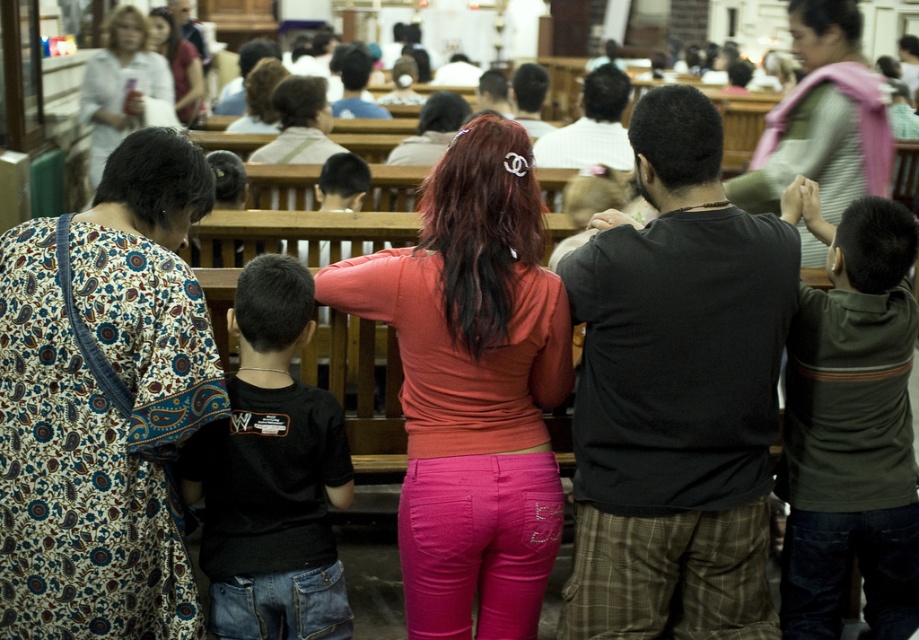
Is dark green hoodie at center closer to the viewer compared to white cotton blouse at upper left?

Yes.

What do you see at coordinates (851, 426) in the screenshot?
I see `dark green hoodie at center` at bounding box center [851, 426].

The image size is (919, 640). What are the coordinates of `dark green hoodie at center` in the screenshot? It's located at (851, 426).

Image resolution: width=919 pixels, height=640 pixels. Identify the location of dark green hoodie at center. (851, 426).

Between dark green hoodie at center and black cotton shirt at left, which one has less height?

black cotton shirt at left is shorter.

Does dark green hoodie at center have a lesser height compared to black cotton shirt at left?

In fact, dark green hoodie at center may be taller than black cotton shirt at left.

Find the location of `dark green hoodie at center`. dark green hoodie at center is located at coordinates (851, 426).

Identify the location of black cotton shirt at left. (271, 474).

Between point (284, 460) and point (766, 148), which one is positioned in front?

Point (284, 460) is more forward.

At what (x,y) coordinates should I click in order to perform the action: click on black cotton shirt at left. Please return your answer as a coordinate pair (x, y). Looking at the image, I should click on (271, 474).